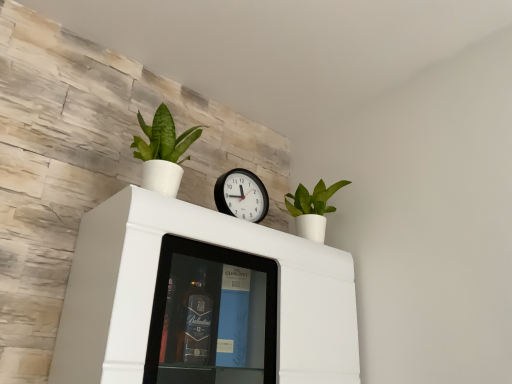
Question: Is black plastic wall clock at center wider or thinner than white matte cabinet at upper center?

Choices:
 (A) wide
 (B) thin

Answer: (B)

Question: From the image's perspective, is black plastic wall clock at center positioned above or below white matte cabinet at upper center?

Choices:
 (A) above
 (B) below

Answer: (A)

Question: Which object is the closest to the green matte plant at upper left, which is the second houseplant in back-to-front order?

Choices:
 (A) black plastic wall clock at center
 (B) white matte cabinet at upper center
 (C) green matte plant at upper right, marked as the second houseplant in a left-to-right arrangement

Answer: (A)

Question: Estimate the real-world distances between objects in this image. Which object is farther from the black plastic wall clock at center?

Choices:
 (A) white matte cabinet at upper center
 (B) green matte plant at upper left, the second houseplant viewed from the right
 (C) green matte plant at upper right, marked as the second houseplant in a left-to-right arrangement

Answer: (A)